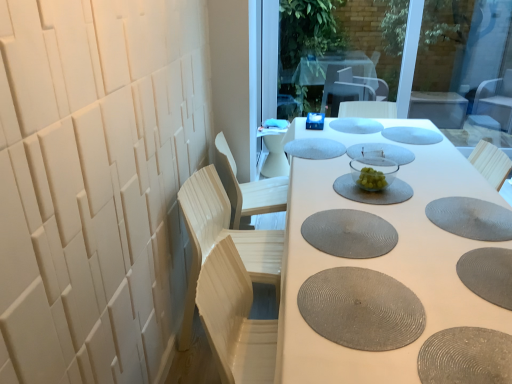
Identify the location of empty space that is in between light blue fabric cushion at center, placed as the 8th manhole cover when sorted from front to back, and gray textured placemat at center, placed as the seventh manhole cover when sorted from back to front. (325, 182).